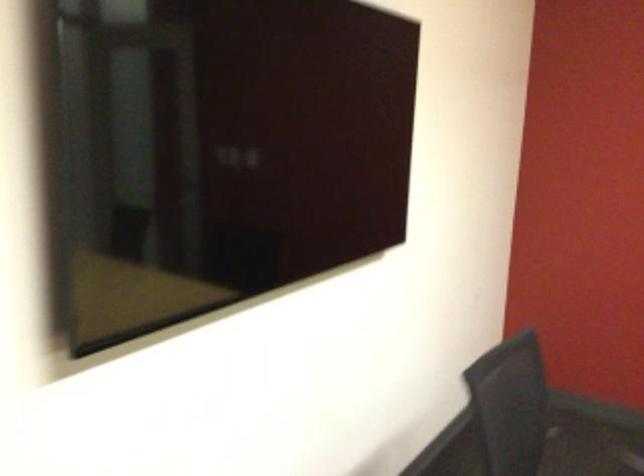
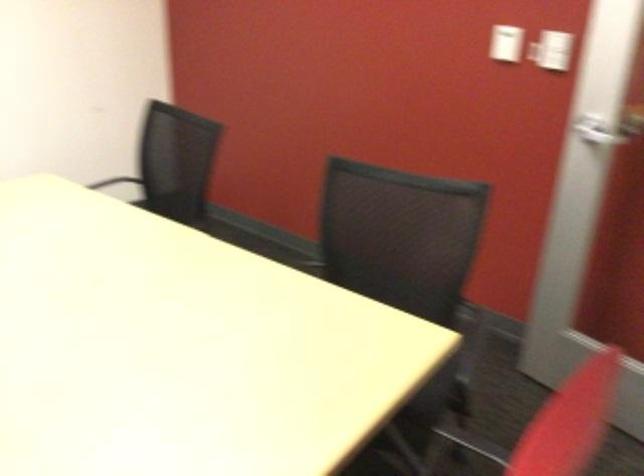
Question: In a continuous first-person perspective shot, in which direction is the camera moving?

Choices:
 (A) Left
 (B) Right
 (C) Forward
 (D) Backward

Answer: (B)